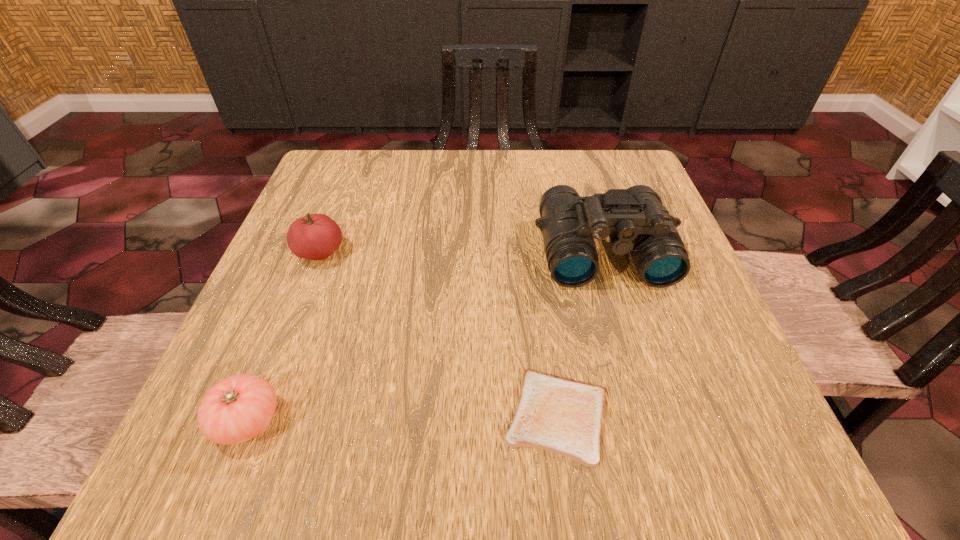
This screenshot has width=960, height=540. Identify the location of the tallest object. (635, 220).

Locate an element on the screen. The width and height of the screenshot is (960, 540). the farther tomato is located at coordinates (315, 236).

The height and width of the screenshot is (540, 960). Identify the location of the third shortest object. [x=315, y=236].

I want to click on the third tallest object, so click(238, 408).

The image size is (960, 540). Find the location of `the nearer tomato`. the nearer tomato is located at coordinates (238, 408).

Find the location of a particular element. The image size is (960, 540). toast is located at coordinates (563, 416).

Find the location of a particular element. The width and height of the screenshot is (960, 540). vacant region located through the lenses of the binoculars is located at coordinates (641, 379).

At what (x,y) coordinates should I click in order to perform the action: click on free space located 0.320m on the right of the third shortest object. Please return your answer as a coordinate pair (x, y). The width and height of the screenshot is (960, 540). Looking at the image, I should click on (504, 253).

The height and width of the screenshot is (540, 960). Find the location of `vacant region located 0.320m on the back of the second shortest object`. vacant region located 0.320m on the back of the second shortest object is located at coordinates (315, 251).

Locate an element on the screen. This screenshot has height=540, width=960. vacant point located 0.050m on the left of the shortest object is located at coordinates 469,416.